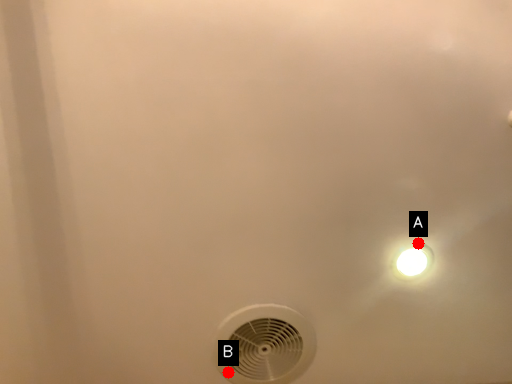
Question: Two points are circled on the image, labeled by A and B beside each circle. Which of the following is the farthest from the observer?

Choices:
 (A) A is further
 (B) B is further

Answer: (B)